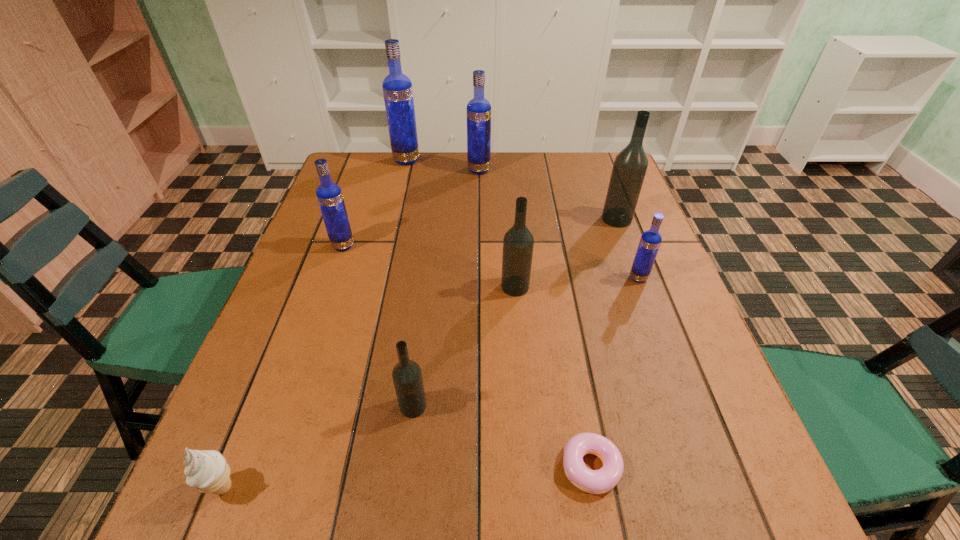
Where is `the fourth closest blue vodka relative to the seventh farthest object`? the fourth closest blue vodka relative to the seventh farthest object is located at coordinates (x=397, y=88).

Select which blue vodka is the closest to the leftmost object. Please provide its 2D coordinates. Your answer should be formatted as a tuple, i.e. [(x, y)], where the tuple contains the x and y coordinates of a point satisfying the conditions above.

[(329, 195)]

Where is `the second closest black vodka relative to the leftmost black vodka`? The height and width of the screenshot is (540, 960). the second closest black vodka relative to the leftmost black vodka is located at coordinates (630, 165).

This screenshot has width=960, height=540. Identify the location of the third closest black vodka to the tallest vodka. (407, 377).

Locate an element on the screen. The width and height of the screenshot is (960, 540). free region that satisfies the following two spatial constraints: 1. on the back side of the farthest black vodka; 2. on the left side of the second smallest black vodka is located at coordinates (510, 219).

What are the coordinates of `vacant space that satisfies the following two spatial constraints: 1. on the front side of the second object from left to right; 2. on the right side of the rightmost blue vodka` in the screenshot? It's located at pyautogui.click(x=332, y=278).

At what (x,y) coordinates should I click in order to perform the action: click on blank space that satisfies the following two spatial constraints: 1. on the front side of the shortest object; 2. on the right side of the second object from left to right. Please return your answer as a coordinate pair (x, y). The height and width of the screenshot is (540, 960). Looking at the image, I should click on coord(267,467).